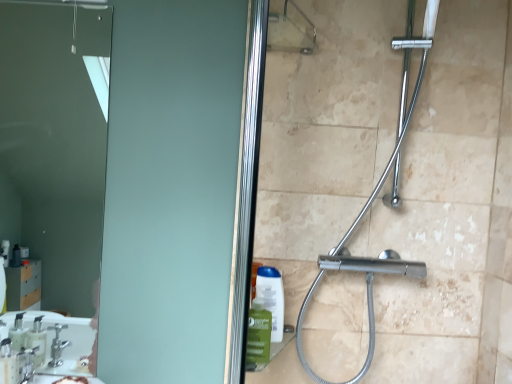
Describe the element at coordinates (57, 138) in the screenshot. I see `matte glass mirror at upper left` at that location.

In order to face translucent plastic soap dispenser at lower left, should I rotate leftwards or rightwards?

Rotate your view left by about 30.773°.

This screenshot has height=384, width=512. What are the coordinates of `translucent plastic soap dispenser at lower left` in the screenshot? It's located at (8, 363).

Locate an element on the screen. The image size is (512, 384). matte glass mirror at upper left is located at coordinates (57, 138).

Is translucent plastic soap dispenser at lower left next to matte glass mirror at upper left?

translucent plastic soap dispenser at lower left is not next to matte glass mirror at upper left, and they're not touching.

Is translucent plastic soap dispenser at lower left at the right side of matte glass mirror at upper left?

No, translucent plastic soap dispenser at lower left is not to the right of matte glass mirror at upper left.

How different are the orientations of translucent plastic soap dispenser at lower left and matte glass mirror at upper left in degrees?

There is a 3.64-degree angle between the facing directions of translucent plastic soap dispenser at lower left and matte glass mirror at upper left.

Between chrome metallic shower at center and translucent plastic soap dispenser at lower left, which one appears on the left side from the viewer's perspective?

From the viewer's perspective, translucent plastic soap dispenser at lower left appears more on the left side.

Considering the relative sizes of chrome metallic shower at center and translucent plastic soap dispenser at lower left in the image provided, is chrome metallic shower at center bigger than translucent plastic soap dispenser at lower left?

Indeed, chrome metallic shower at center has a larger size compared to translucent plastic soap dispenser at lower left.

Is chrome metallic shower at center inside or outside of translucent plastic soap dispenser at lower left?

chrome metallic shower at center is spatially situated outside translucent plastic soap dispenser at lower left.

Which of these two, chrome metallic shower at center or translucent plastic soap dispenser at lower left, stands taller?

chrome metallic shower at center.

Is matte glass mirror at upper left to the left or to the right of translucent plastic soap dispenser at lower left in the image?

matte glass mirror at upper left is positioned on translucent plastic soap dispenser at lower left's right side.

From the image's perspective, is matte glass mirror at upper left above translucent plastic soap dispenser at lower left?

Yes, from the image's perspective, matte glass mirror at upper left is over translucent plastic soap dispenser at lower left.

Is matte glass mirror at upper left not near translucent plastic soap dispenser at lower left?

Yes.

Which is less distant, (x=44, y=10) or (x=2, y=367)?

The point (x=2, y=367) is in front.

Is matte glass mirror at upper left positioned behind chrome metallic shower at center?

Yes, it is behind chrome metallic shower at center.

Considering the sizes of matte glass mirror at upper left and chrome metallic shower at center in the image, is matte glass mirror at upper left wider or thinner than chrome metallic shower at center?

In the image, matte glass mirror at upper left appears to be more narrow than chrome metallic shower at center.

What's the angular difference between matte glass mirror at upper left and chrome metallic shower at center's facing directions?

matte glass mirror at upper left and chrome metallic shower at center are facing 0.307 degrees away from each other.

Is matte glass mirror at upper left turned away from chrome metallic shower at center?

No, matte glass mirror at upper left's orientation is not away from chrome metallic shower at center.

Is translucent plastic soap dispenser at lower left not near chrome metallic shower at center?

That's right, there is a large distance between translucent plastic soap dispenser at lower left and chrome metallic shower at center.

Is chrome metallic shower at center a part of translucent plastic soap dispenser at lower left?

No, chrome metallic shower at center is not surrounded by translucent plastic soap dispenser at lower left.

From the picture: Does translucent plastic soap dispenser at lower left lie behind chrome metallic shower at center?

Yes, it is behind chrome metallic shower at center.

From a real-world perspective, who is located higher, translucent plastic soap dispenser at lower left or chrome metallic shower at center?

chrome metallic shower at center.

Which is more to the right, chrome metallic shower at center or matte glass mirror at upper left?

Positioned to the right is chrome metallic shower at center.

Is chrome metallic shower at center completely or partially outside of matte glass mirror at upper left?

Absolutely, chrome metallic shower at center is external to matte glass mirror at upper left.

From the image's perspective, is chrome metallic shower at center located above matte glass mirror at upper left?

No.

Is chrome metallic shower at center aimed at matte glass mirror at upper left?

No, chrome metallic shower at center is not facing towards matte glass mirror at upper left.

Where is `soap dispenser lying on the left of matte glass mirror at upper left`? soap dispenser lying on the left of matte glass mirror at upper left is located at coordinates (8, 363).

Find the location of a particular element. This screenshot has width=512, height=384. soap dispenser behind the chrome metallic shower at center is located at coordinates (8, 363).

From the picture: Which object lies nearer to the anchor point matte glass mirror at upper left, translucent plastic soap dispenser at lower left or chrome metallic shower at center?

translucent plastic soap dispenser at lower left lies closer to matte glass mirror at upper left than the other object.

Based on their spatial positions, is matte glass mirror at upper left or chrome metallic shower at center closer to translucent plastic soap dispenser at lower left?

chrome metallic shower at center is closer to translucent plastic soap dispenser at lower left.

Considering their positions, is chrome metallic shower at center positioned closer to matte glass mirror at upper left than translucent plastic soap dispenser at lower left?

Among the two, translucent plastic soap dispenser at lower left is located nearer to matte glass mirror at upper left.

Estimate the real-world distances between objects in this image. Which object is closer to translucent plastic soap dispenser at lower left, chrome metallic shower at center or matte glass mirror at upper left?

Among the two, chrome metallic shower at center is located nearer to translucent plastic soap dispenser at lower left.

Looking at the image, which one is located closer to chrome metallic shower at center, matte glass mirror at upper left or translucent plastic soap dispenser at lower left?

translucent plastic soap dispenser at lower left lies closer to chrome metallic shower at center than the other object.

Which object lies nearer to the anchor point chrome metallic shower at center, translucent plastic soap dispenser at lower left or matte glass mirror at upper left?

Based on the image, translucent plastic soap dispenser at lower left appears to be nearer to chrome metallic shower at center.

I want to click on mirror situated between translucent plastic soap dispenser at lower left and chrome metallic shower at center from left to right, so click(x=57, y=138).